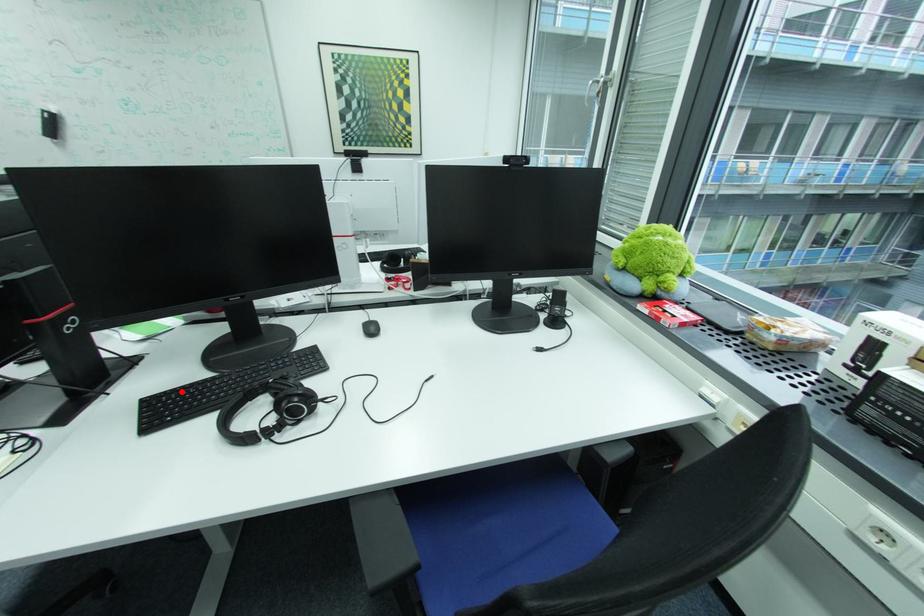
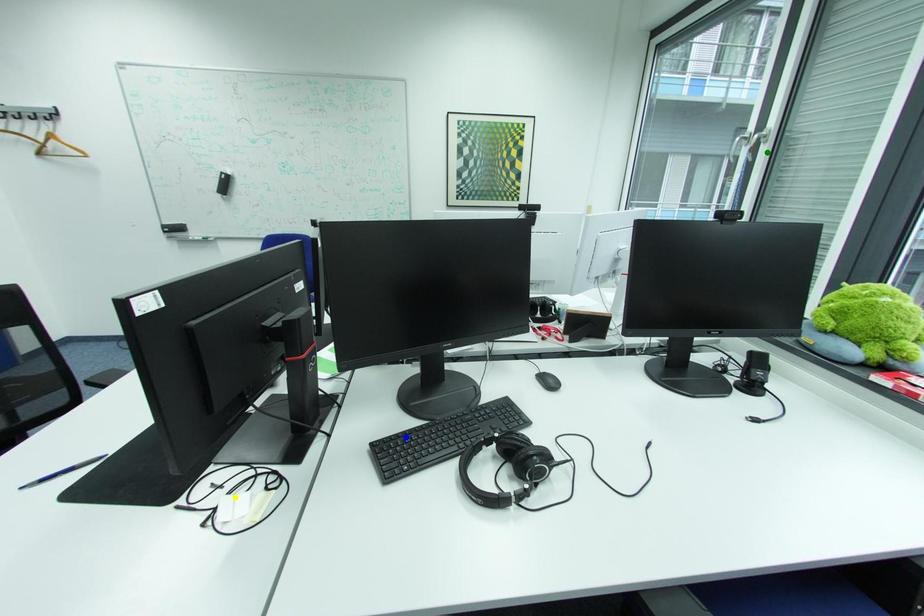
Question: I am providing you with two images of the same scene from different viewpoints. A red point is marked on the first image. You are given multiple points on the second image. In image 2, which mark is for the same physical point as the one in image 1?

Choices:
 (A) green point
 (B) blue point
 (C) yellow point

Answer: (B)